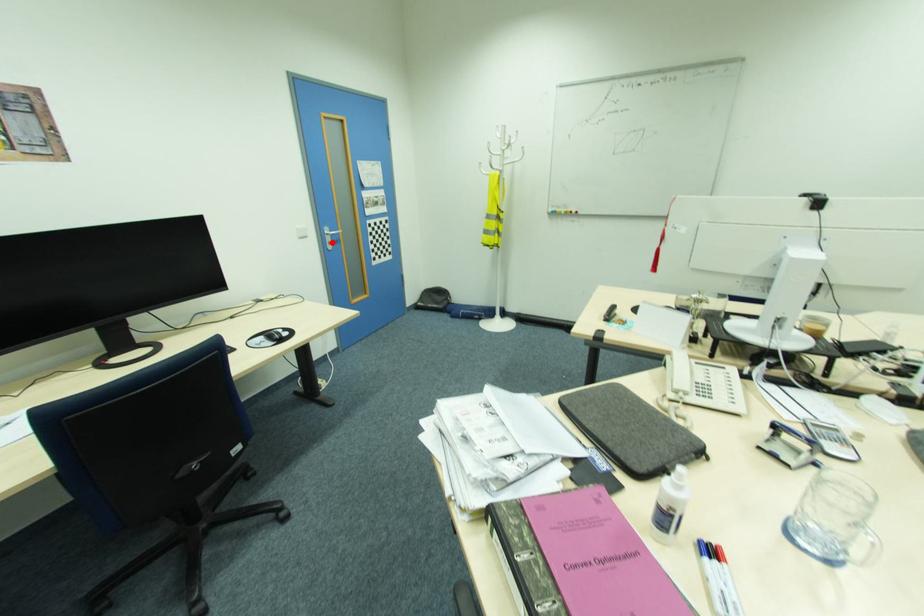
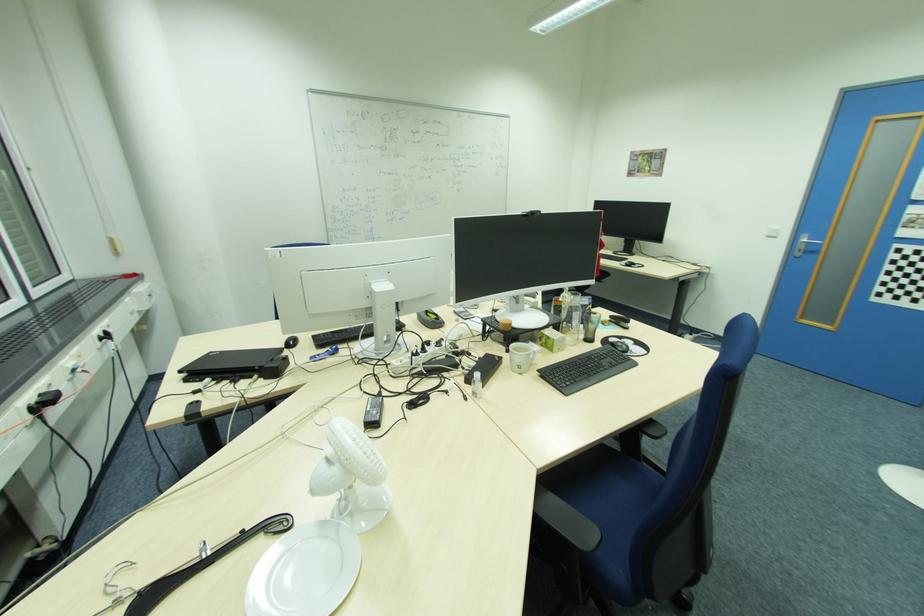
Find the pixel in the second image that matches the highlighted location in the first image.

(804, 251)